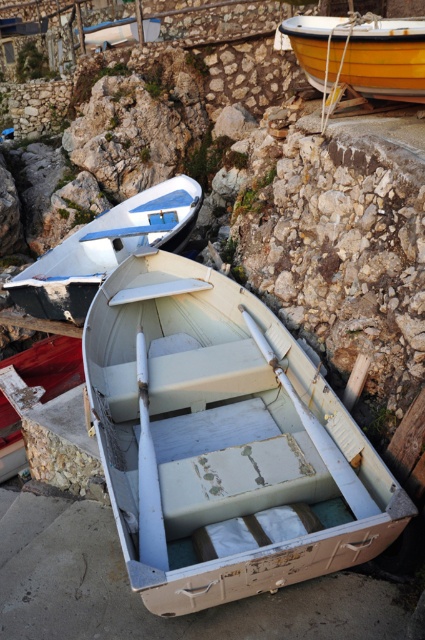
Question: In this image, where is white faded wood boat at center located relative to white matte boat at upper center?

Choices:
 (A) left
 (B) right

Answer: (B)

Question: Can you confirm if white faded wood boat at center is thinner than white matte boat at upper center?

Choices:
 (A) no
 (B) yes

Answer: (B)

Question: Based on their relative distances, which object is farther from the white matte boat at upper center?

Choices:
 (A) yellow polished wood boat at upper right
 (B) white faded wood boat at center

Answer: (A)

Question: Which of the following is the closest to the observer?

Choices:
 (A) (42, 314)
 (B) (416, 19)
 (C) (195, 435)

Answer: (C)

Question: Is white matte boat at upper center smaller than yellow polished wood boat at upper right?

Choices:
 (A) yes
 (B) no

Answer: (B)

Question: Which point appears closest to the camera in this image?

Choices:
 (A) (96, 284)
 (B) (144, 552)
 (C) (408, 68)

Answer: (B)